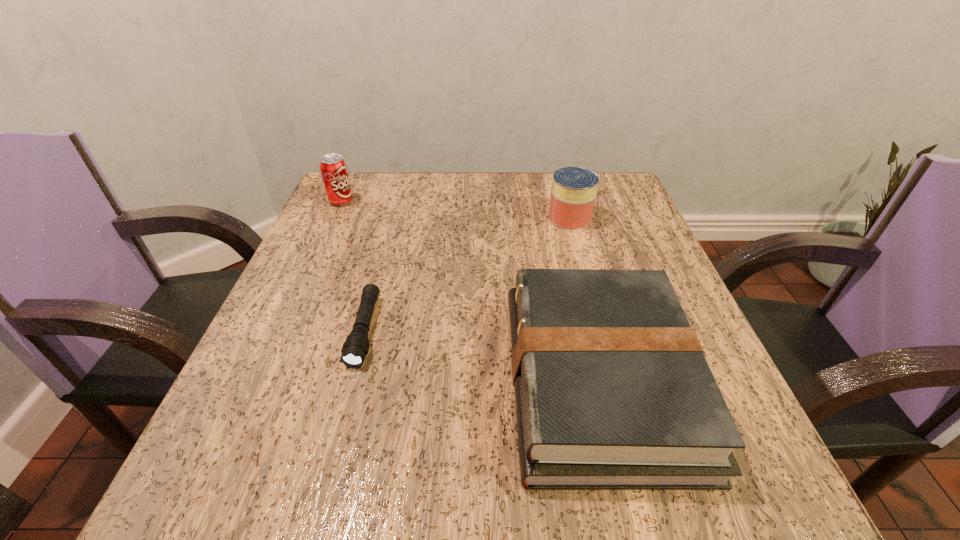
The image size is (960, 540). Find the location of `object at the near right corner`. object at the near right corner is located at coordinates (612, 389).

In the image, there is a desktop. Where is `vacant space at the far edge`? The image size is (960, 540). vacant space at the far edge is located at coordinates (519, 188).

In the image, there is a desktop. What are the coordinates of `free region at the near edge` in the screenshot? It's located at (380, 473).

In the image, there is a desktop. Where is `vacant space at the left edge`? The image size is (960, 540). vacant space at the left edge is located at coordinates (365, 228).

Where is `free space at the right edge of the desktop`? The height and width of the screenshot is (540, 960). free space at the right edge of the desktop is located at coordinates (618, 235).

Locate an element on the screen. This screenshot has width=960, height=540. free space at the far left corner is located at coordinates (349, 208).

In the image, there is a desktop. Where is `vacant space at the near left corner`? vacant space at the near left corner is located at coordinates (x=232, y=479).

In the image, there is a desktop. Where is `vacant region at the far right corner`? This screenshot has width=960, height=540. vacant region at the far right corner is located at coordinates (629, 197).

Image resolution: width=960 pixels, height=540 pixels. Identify the location of vacant area that lies between the flashlight and the hardback book. (482, 355).

Where is `free space between the soda and the second object from left to right`? The width and height of the screenshot is (960, 540). free space between the soda and the second object from left to right is located at coordinates coord(353,266).